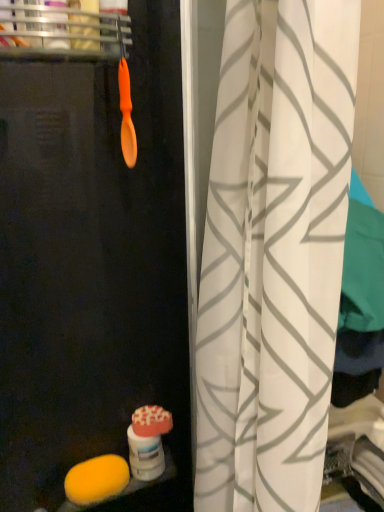
Question: Can orange plastic spoon at upper left be found inside yellow sponge at lower left?

Choices:
 (A) no
 (B) yes

Answer: (A)

Question: From the image's perspective, is yellow sponge at lower left located beneath orange plastic spoon at upper left?

Choices:
 (A) no
 (B) yes

Answer: (B)

Question: Considering the relative positions of yellow sponge at lower left and orange plastic spoon at upper left in the image provided, is yellow sponge at lower left in front of orange plastic spoon at upper left?

Choices:
 (A) no
 (B) yes

Answer: (A)

Question: Can you confirm if yellow sponge at lower left is thinner than orange plastic spoon at upper left?

Choices:
 (A) no
 (B) yes

Answer: (B)

Question: Can you confirm if yellow sponge at lower left is positioned to the left of orange plastic spoon at upper left?

Choices:
 (A) no
 (B) yes

Answer: (A)

Question: Do you think orange matte spoon at upper left is within orange plastic spoon at upper left, or outside of it?

Choices:
 (A) inside
 (B) outside

Answer: (B)

Question: From a real-world perspective, is orange matte spoon at upper left physically located above or below orange plastic spoon at upper left?

Choices:
 (A) above
 (B) below

Answer: (B)

Question: From the image's perspective, is orange matte spoon at upper left positioned above or below orange plastic spoon at upper left?

Choices:
 (A) above
 (B) below

Answer: (B)

Question: In the image, is orange matte spoon at upper left positioned in front of or behind orange plastic spoon at upper left?

Choices:
 (A) front
 (B) behind

Answer: (B)

Question: Looking at the image, does white fabric curtain at center seem bigger or smaller compared to orange plastic spoon at upper left?

Choices:
 (A) big
 (B) small

Answer: (A)

Question: From a real-world perspective, relative to orange plastic spoon at upper left, is white fabric curtain at center vertically above or below?

Choices:
 (A) below
 (B) above

Answer: (A)

Question: Is white fabric curtain at center in front of or behind orange plastic spoon at upper left in the image?

Choices:
 (A) front
 (B) behind

Answer: (A)

Question: In terms of width, does white fabric curtain at center look wider or thinner when compared to orange plastic spoon at upper left?

Choices:
 (A) thin
 (B) wide

Answer: (B)

Question: Considering their positions, is orange matte spoon at upper left located in front of or behind transparent plastic screen door at center?

Choices:
 (A) behind
 (B) front

Answer: (A)

Question: From a real-world perspective, relative to transparent plastic screen door at center, is orange matte spoon at upper left vertically above or below?

Choices:
 (A) below
 (B) above

Answer: (B)